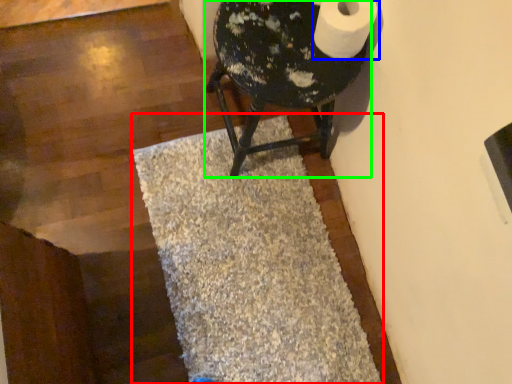
Question: Estimate the real-world distances between objects in this image. Which object is farther from bath mat (highlighted by a red box), toilet paper (highlighted by a blue box) or furniture (highlighted by a green box)?

Choices:
 (A) toilet paper
 (B) furniture

Answer: (A)